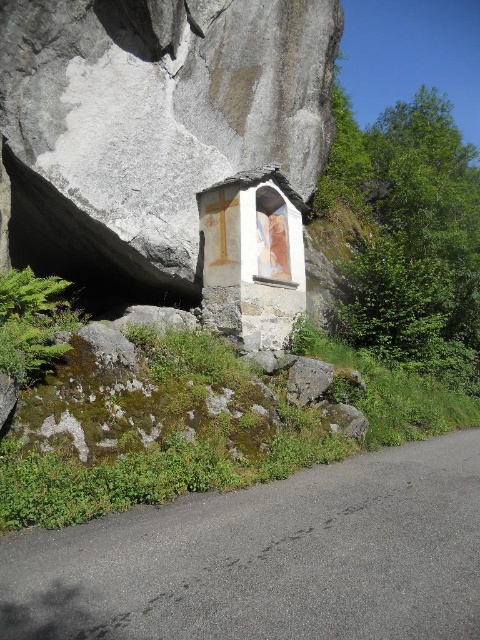
Who is positioned more to the left, smooth gray rock at center or white painted stone chapel at center?

From the viewer's perspective, smooth gray rock at center appears more on the left side.

Can you confirm if smooth gray rock at center is positioned above white painted stone chapel at center?

Yes, smooth gray rock at center is above white painted stone chapel at center.

At what (x,y) coordinates should I click in order to perform the action: click on smooth gray rock at center. Please return your answer as a coordinate pair (x, y). This screenshot has height=640, width=480. Looking at the image, I should click on (152, 125).

Is smooth gray rock at center thinner than asphalt road at lower center?

No.

What do you see at coordinates (152, 125) in the screenshot? I see `smooth gray rock at center` at bounding box center [152, 125].

Is point (104, 17) positioned behind point (43, 632)?

Yes, point (104, 17) is behind point (43, 632).

Identify the location of smooth gray rock at center. (152, 125).

Looking at this image, between asphalt road at lower center and white painted stone chapel at center, which one appears on the right side from the viewer's perspective?

From the viewer's perspective, asphalt road at lower center appears more on the right side.

Is point (74, 573) positioned behind point (204, 243)?

No, it is not.

Between point (188, 554) and point (269, 292), which one is positioned in front?

Point (188, 554) is in front.

Locate an element on the screen. asphalt road at lower center is located at coordinates (268, 557).